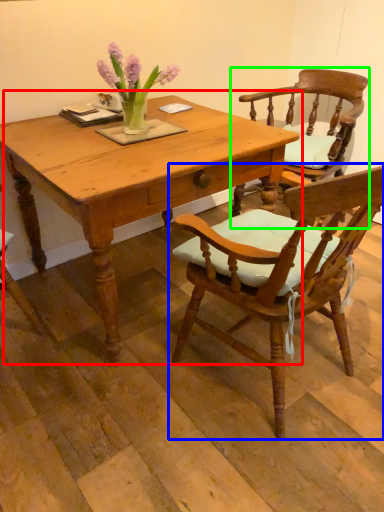
Question: Considering the real-world distances, which object is farthest from table (highlighted by a red box)? chair (highlighted by a blue box) or chair (highlighted by a green box)?

Choices:
 (A) chair
 (B) chair

Answer: (B)